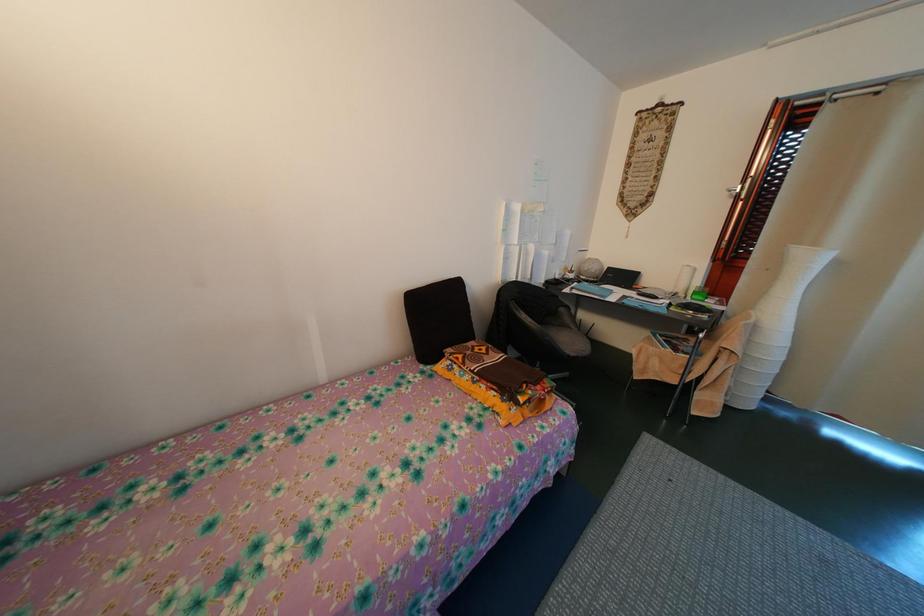
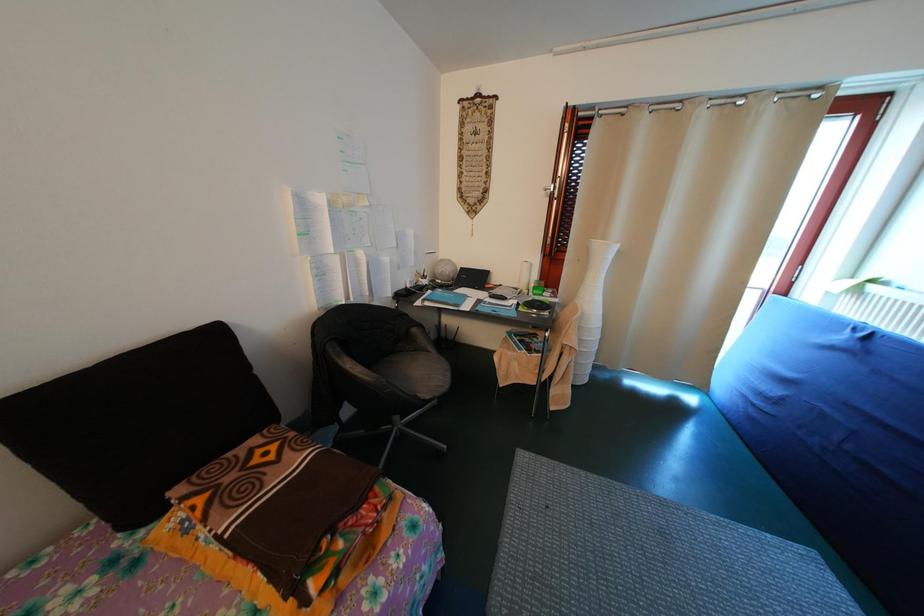
Question: The first image is from the beginning of the video and the second image is from the end. How did the camera likely rotate when shooting the video?

Choices:
 (A) Left
 (B) Right
 (C) Up
 (D) Down

Answer: (B)